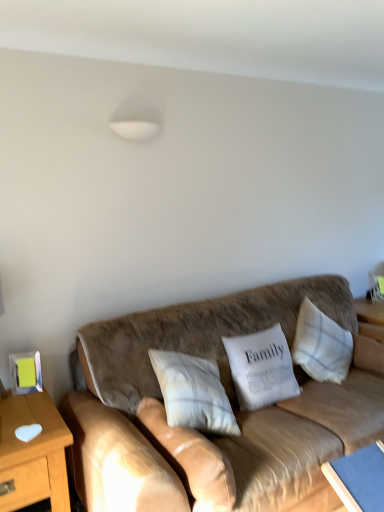
Where is `blank space situated above wooden table at left, the first table when ordered from left to right (from a real-world perspective)`? The height and width of the screenshot is (512, 384). blank space situated above wooden table at left, the first table when ordered from left to right (from a real-world perspective) is located at coordinates (16, 412).